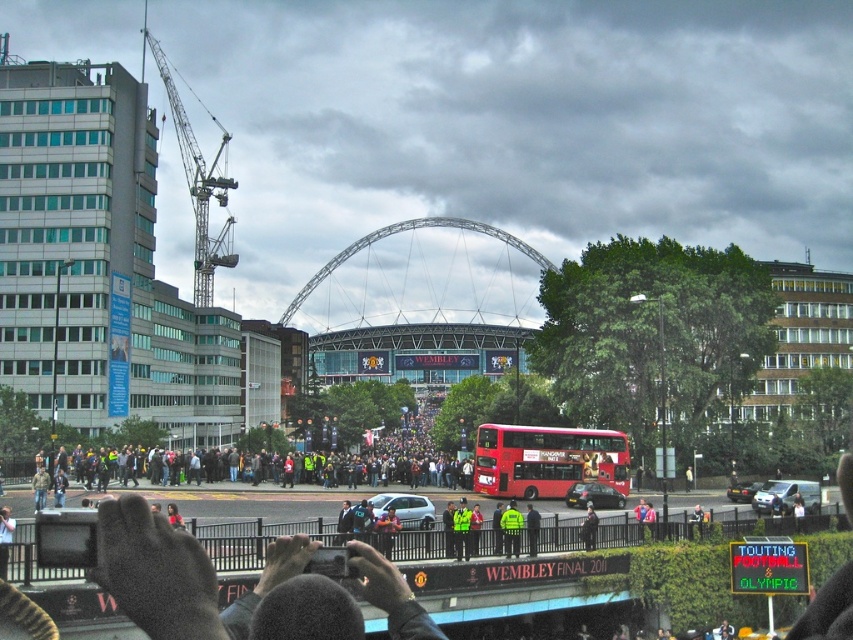
Question: Which point appears farthest from the camera in this image?

Choices:
 (A) (755, 484)
 (B) (495, 456)
 (C) (570, 486)
 (D) (531, 516)

Answer: (A)

Question: Which of these objects is positioned closest to the green uniformed person at center?

Choices:
 (A) metallic silver car at center
 (B) dark blue uniform at center
 (C) silver metallic car at center
 (D) high visibility jacket at center

Answer: (B)

Question: Which point is farther to the camera?

Choices:
 (A) (396, 499)
 (B) (601, 486)
 (C) (453, 518)

Answer: (B)

Question: Is neon green uniform at center to the right of high visibility jacket at center from the viewer's perspective?

Choices:
 (A) yes
 (B) no

Answer: (A)

Question: Is the position of silver metallic car at center more distant than that of dark blue uniform at center?

Choices:
 (A) no
 (B) yes

Answer: (B)

Question: Can you confirm if metallic silver car at lower right is positioned above dark blue uniform at center?

Choices:
 (A) yes
 (B) no

Answer: (A)